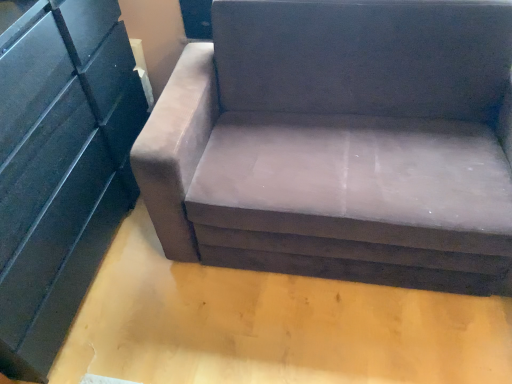
Question: Considering the positions of matte black dresser at left and suede-like brown couch at center in the image, is matte black dresser at left taller or shorter than suede-like brown couch at center?

Choices:
 (A) short
 (B) tall

Answer: (B)

Question: Looking at the image, does matte black dresser at left seem bigger or smaller compared to suede-like brown couch at center?

Choices:
 (A) small
 (B) big

Answer: (A)

Question: From a real-world perspective, is matte black dresser at left above or below suede-like brown couch at center?

Choices:
 (A) above
 (B) below

Answer: (A)

Question: Is point (400, 41) positioned closer to the camera than point (66, 286)?

Choices:
 (A) farther
 (B) closer

Answer: (B)

Question: Looking at the image, does suede-like brown couch at center seem bigger or smaller compared to matte black dresser at left?

Choices:
 (A) big
 (B) small

Answer: (A)

Question: Based on their positions, is suede-like brown couch at center located to the left or right of matte black dresser at left?

Choices:
 (A) left
 (B) right

Answer: (B)

Question: From the image's perspective, relative to matte black dresser at left, is suede-like brown couch at center above or below?

Choices:
 (A) below
 (B) above

Answer: (B)